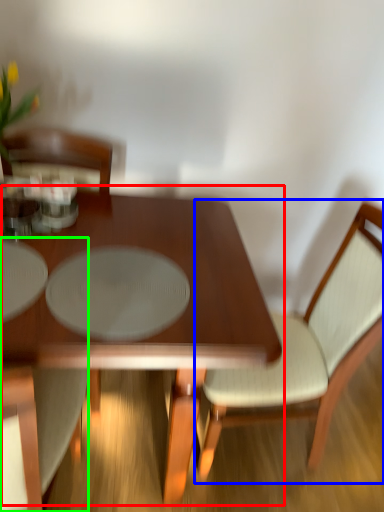
Question: Considering the real-world distances, which object is farthest from coffee table (highlighted by a red box)? chair (highlighted by a blue box) or chair (highlighted by a green box)?

Choices:
 (A) chair
 (B) chair

Answer: (A)